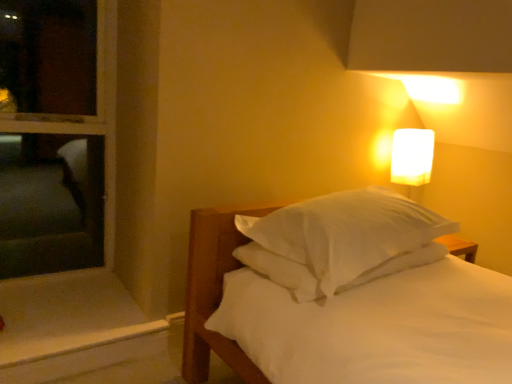
Locate an element on the screen. The width and height of the screenshot is (512, 384). white frosted glass at upper right is located at coordinates (412, 160).

From the image's perspective, between white soft bed at center and white wood window sill at lower left, who is located below?

white wood window sill at lower left, from the image's perspective.

Considering the sizes of objects white soft bed at center and white wood window sill at lower left in the image provided, who is wider, white soft bed at center or white wood window sill at lower left?

white soft bed at center.

The image size is (512, 384). In order to click on bed in front of the white wood window sill at lower left in this screenshot , I will do `click(346, 296)`.

Consider the image. Between white wood window sill at lower left and white frosted glass at upper right, which one has more height?

Standing taller between the two is white frosted glass at upper right.

Does point (3, 345) lie behind point (411, 139)?

That is False.

Is white wood window sill at lower left positioned beyond the bounds of white frosted glass at upper right?

Yes.

Does white wood window sill at lower left have a smaller size compared to white frosted glass at upper right?

Actually, white wood window sill at lower left might be larger than white frosted glass at upper right.

Is white frosted glass at upper right next to white soft bed at center?

white frosted glass at upper right is not next to white soft bed at center, and they're not touching.

Does white frosted glass at upper right have a smaller size compared to white soft bed at center?

Yes.

Based on the photo, could you tell me if white frosted glass at upper right is facing white soft bed at center?

No, white frosted glass at upper right is not turned towards white soft bed at center.

Consider the image. From their relative heights in the image, would you say white soft bed at center is taller or shorter than white frosted glass at upper right?

white soft bed at center is taller than white frosted glass at upper right.

Based on the photo, from the image's perspective, who appears lower, white soft bed at center or white frosted glass at upper right?

white soft bed at center appears lower in the image.

Considering the relative sizes of white soft bed at center and white frosted glass at upper right in the image provided, is white soft bed at center thinner than white frosted glass at upper right?

In fact, white soft bed at center might be wider than white frosted glass at upper right.

Considering the relative positions of white soft bed at center and white frosted glass at upper right in the image provided, is white soft bed at center to the left of white frosted glass at upper right from the viewer's perspective?

Indeed, white soft bed at center is positioned on the left side of white frosted glass at upper right.

Is the position of white wood window sill at lower left more distant than that of white soft bed at center?

Yes, the depth of white wood window sill at lower left is greater than that of white soft bed at center.

From the image's perspective, is white wood window sill at lower left located above white soft bed at center?

Actually, white wood window sill at lower left appears below white soft bed at center in the image.

Considering the sizes of white wood window sill at lower left and white soft bed at center in the image, is white wood window sill at lower left bigger or smaller than white soft bed at center?

Considering their sizes, white wood window sill at lower left takes up less space than white soft bed at center.

Find the location of `bed in front of the white wood window sill at lower left`. bed in front of the white wood window sill at lower left is located at coordinates (346, 296).

Is white frosted glass at upper right next to white wood window sill at lower left?

No, white frosted glass at upper right is not making contact with white wood window sill at lower left.

Is white frosted glass at upper right facing away from white wood window sill at lower left?

white frosted glass at upper right does not have its back to white wood window sill at lower left.

Considering the relative sizes of white frosted glass at upper right and white wood window sill at lower left in the image provided, is white frosted glass at upper right wider than white wood window sill at lower left?

No, white frosted glass at upper right is not wider than white wood window sill at lower left.

The width and height of the screenshot is (512, 384). In order to click on window sill that is on the left side of white soft bed at center in this screenshot , I will do `click(71, 326)`.

This screenshot has width=512, height=384. What are the coordinates of `window sill below the white frosted glass at upper right (from a real-world perspective)` in the screenshot? It's located at (71, 326).

Which object lies nearer to the anchor point white soft bed at center, white wood window sill at lower left or white frosted glass at upper right?

white wood window sill at lower left is positioned closer to the anchor white soft bed at center.

Which object lies further to the anchor point white frosted glass at upper right, white wood window sill at lower left or white soft bed at center?

white wood window sill at lower left is further to white frosted glass at upper right.

Estimate the real-world distances between objects in this image. Which object is closer to white wood window sill at lower left, white soft bed at center or white frosted glass at upper right?

white soft bed at center is closer to white wood window sill at lower left.

Estimate the real-world distances between objects in this image. Which object is further from white soft bed at center, white frosted glass at upper right or white wood window sill at lower left?

white frosted glass at upper right lies further to white soft bed at center than the other object.

Which object lies further to the anchor point white wood window sill at lower left, white frosted glass at upper right or white soft bed at center?

white frosted glass at upper right is further to white wood window sill at lower left.

Estimate the real-world distances between objects in this image. Which object is closer to white frosted glass at upper right, white soft bed at center or white wood window sill at lower left?

white soft bed at center.

In order to click on bed between white wood window sill at lower left and white frosted glass at upper right in the horizontal direction in this screenshot , I will do `click(346, 296)`.